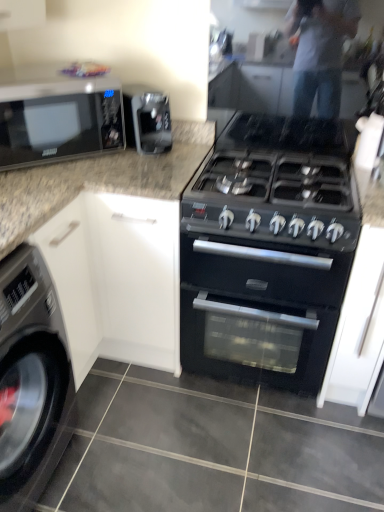
Question: From a real-world perspective, is black matte oven at center above or below black glossy microwave at upper left?

Choices:
 (A) below
 (B) above

Answer: (A)

Question: Considering the positions of point (244, 352) and point (26, 101), is point (244, 352) closer or farther from the camera than point (26, 101)?

Choices:
 (A) closer
 (B) farther

Answer: (B)

Question: Estimate the real-world distances between objects in this image. Which object is farther from the metallic gray washing machine at lower left?

Choices:
 (A) black glossy microwave at upper left
 (B) satin black coffee machine at upper center
 (C) black matte gas stove at center
 (D) black matte oven at center

Answer: (C)

Question: Which is farther from the black matte gas stove at center?

Choices:
 (A) black glossy microwave at upper left
 (B) black matte oven at center
 (C) satin black coffee machine at upper center
 (D) metallic gray washing machine at lower left

Answer: (D)